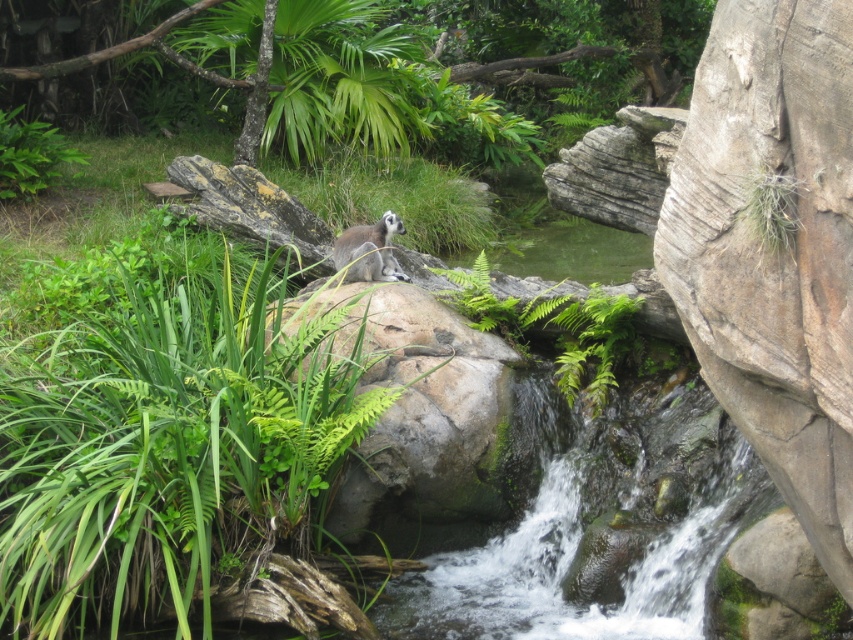
Consider the image. Measure the distance from green leafy fern at upper center to ring-tailed lemur at center.

green leafy fern at upper center is 1.67 meters away from ring-tailed lemur at center.

Does green leafy fern at upper center have a smaller size compared to ring-tailed lemur at center?

Incorrect, green leafy fern at upper center is not smaller in size than ring-tailed lemur at center.

This screenshot has height=640, width=853. I want to click on green leafy fern at upper center, so click(167, 442).